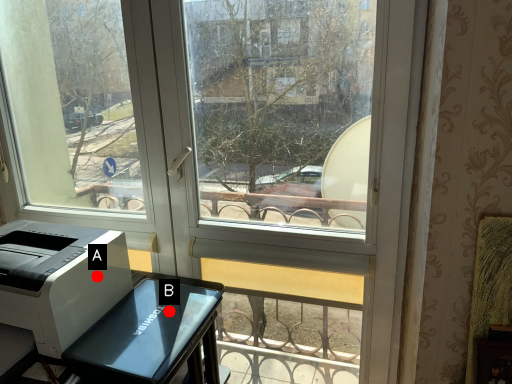
Question: Two points are circled on the image, labeled by A and B beside each circle. Which point appears farthest from the camera in this image?

Choices:
 (A) A is further
 (B) B is further

Answer: (B)